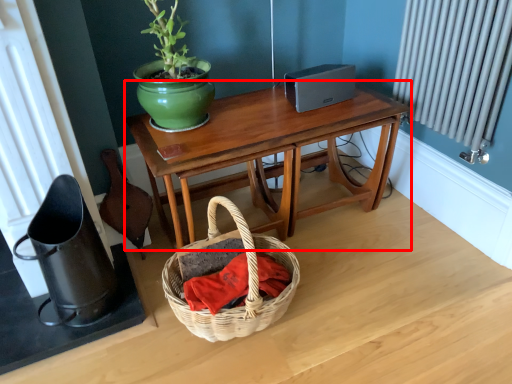
Question: From the image's perspective, what is the correct spatial relationship of table (annotated by the red box) in relation to material?

Choices:
 (A) above
 (B) below

Answer: (A)